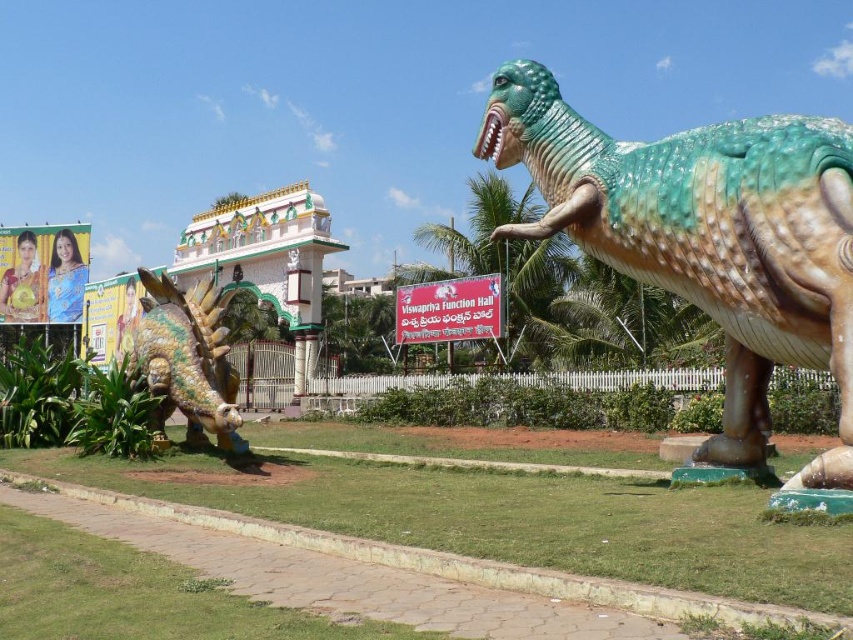
Question: Which point is farther to the camera?

Choices:
 (A) shiny green plastic dinosaur at right
 (B) shiny gold plated dragon at center

Answer: (B)

Question: From the image, what is the correct spatial relationship of shiny green plastic dinosaur at right in relation to shiny gold plated dragon at center?

Choices:
 (A) right
 (B) left

Answer: (A)

Question: Can you confirm if shiny green plastic dinosaur at right is bigger than shiny gold plated dragon at center?

Choices:
 (A) yes
 (B) no

Answer: (B)

Question: Which point is closer to the camera?

Choices:
 (A) (717, 260)
 (B) (142, 280)

Answer: (A)

Question: Does shiny green plastic dinosaur at right appear on the right side of shiny gold plated dragon at center?

Choices:
 (A) yes
 (B) no

Answer: (A)